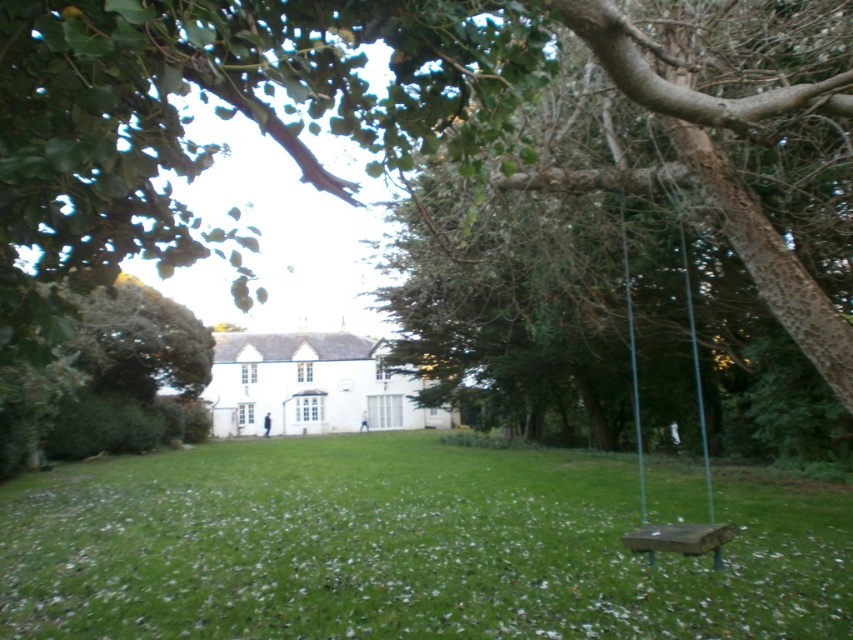
Question: Does smooth bark tree at center lie behind wooden swing at right?

Choices:
 (A) yes
 (B) no

Answer: (B)

Question: Which of these objects is positioned closest to the smooth bark tree at center?

Choices:
 (A) wooden swing at right
 (B) green grass at lower center

Answer: (A)

Question: Which object is the farthest from the green grass at lower center?

Choices:
 (A) wooden swing at right
 (B) smooth bark tree at center

Answer: (B)

Question: Does green grass at lower center have a lesser width compared to wooden swing at right?

Choices:
 (A) no
 (B) yes

Answer: (A)

Question: Does green grass at lower center have a greater width compared to wooden swing at right?

Choices:
 (A) yes
 (B) no

Answer: (A)

Question: Which object is closer to the camera taking this photo?

Choices:
 (A) green grass at lower center
 (B) smooth bark tree at center

Answer: (B)